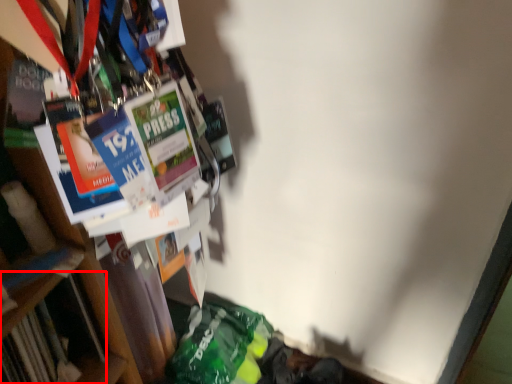
Question: From the image's perspective, considering the relative positions of book (annotated by the red box) and bookcase in the image provided, where is book (annotated by the red box) located with respect to the staircase?

Choices:
 (A) above
 (B) below

Answer: (B)